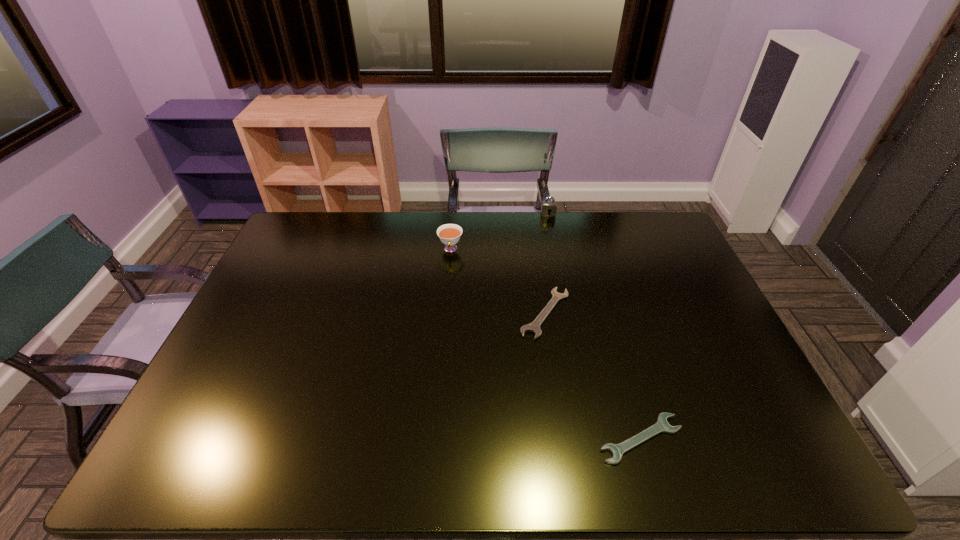
Locate an element on the screen. Image resolution: width=960 pixels, height=540 pixels. the farthest object is located at coordinates (547, 206).

Where is `teacup`? The image size is (960, 540). teacup is located at coordinates 449,234.

Find the location of a particular element. The height and width of the screenshot is (540, 960). the leftmost object is located at coordinates (449, 234).

You are a GUI agent. You are given a task and a screenshot of the screen. Output one action in this format:
    pyautogui.click(x=<x>, y=<y>)
    Task: Click on the third farthest object
    The height and width of the screenshot is (540, 960).
    Given the screenshot: What is the action you would take?
    pyautogui.click(x=534, y=327)

At what (x,y) coordinates should I click in order to perform the action: click on the nearer wrench. Please return your answer as a coordinate pair (x, y). The height and width of the screenshot is (540, 960). Looking at the image, I should click on (662, 426).

Where is `vacant space located at the front of the padlock near the keyhole`? The width and height of the screenshot is (960, 540). vacant space located at the front of the padlock near the keyhole is located at coordinates (563, 284).

This screenshot has height=540, width=960. Find the location of `free spot located on the side of the leftmost object with the handle`. free spot located on the side of the leftmost object with the handle is located at coordinates click(445, 316).

I want to click on blank space located 0.160m on the back of the farther wrench, so click(x=537, y=257).

Image resolution: width=960 pixels, height=540 pixels. What are the coordinates of `vacant space located 0.170m on the left of the nearest object` in the screenshot? It's located at (524, 438).

This screenshot has height=540, width=960. I want to click on padlock located at the far edge, so click(547, 206).